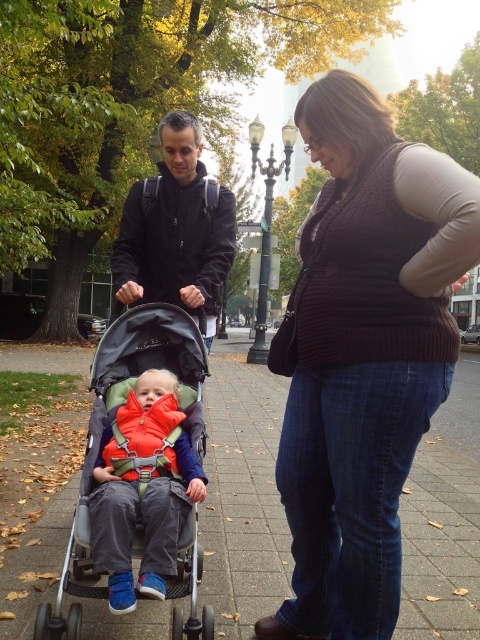
You are a photographer trying to capture the scene. You notice two items at the center of the image labeled as knit sweater at center and matte orange jacket at center. Which item is positioned higher in the frame?

The knit sweater at center is above the matte orange jacket at center, so it is positioned higher in the frame.